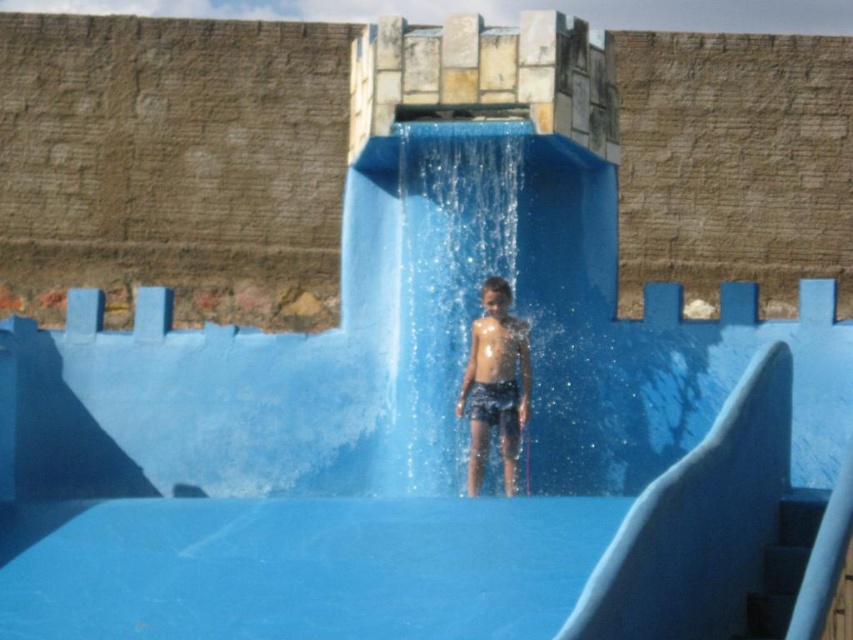
You are a photographer trying to capture the child at the bottom of the blue water slide. You notice the shiny blue shorts at center and the shiny skin at center. Which object is located to the right of the other?

The shiny blue shorts at center is positioned on the right side of shiny skin at center.

You are a lifeguard observing a child at the bottom of a blue water slide in a water park. You notice clear water at center and shiny skin at center. Which object is positioned higher in the scene?

The clear water at center is located above the shiny skin at center, so it is positioned higher in the scene.